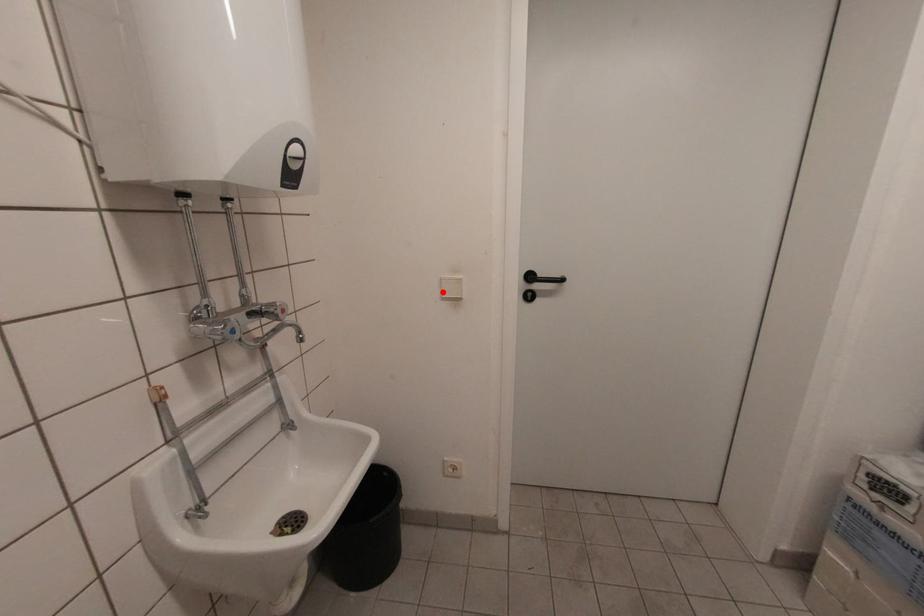
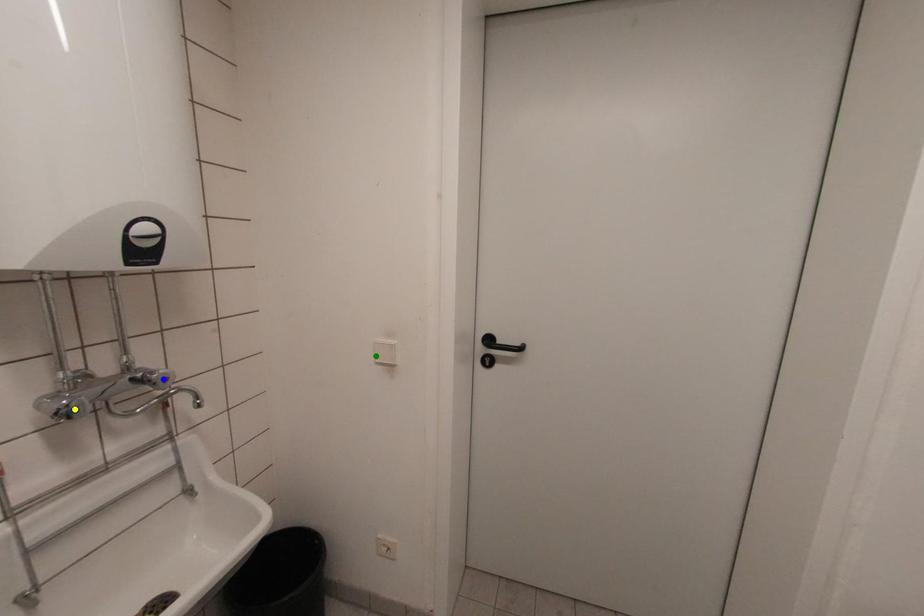
Question: I am providing you with two images of the same scene from different viewpoints. A red point is marked on the first image. You are given multiple points on the second image. In image 2, which mark is for the same physical point as the one in image 1?

Choices:
 (A) blue point
 (B) green point
 (C) yellow point

Answer: (B)